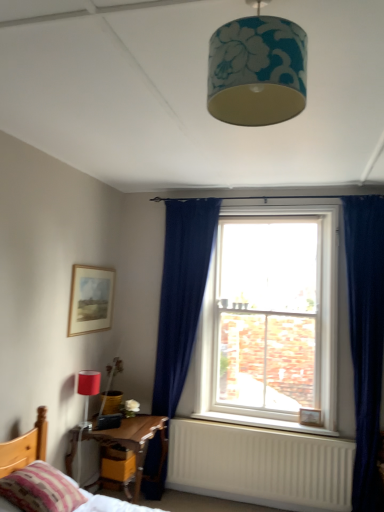
Question: Can you confirm if wooden picture frame at lower right, the first picture frame from the back, is positioned to the right of white painted wood at lower center?

Choices:
 (A) yes
 (B) no

Answer: (A)

Question: Can you confirm if wooden picture frame at lower right, which ranks as the second picture frame in left-to-right order, is smaller than white painted wood at lower center?

Choices:
 (A) yes
 (B) no

Answer: (A)

Question: From the image's perspective, does wooden picture frame at lower right, which ranks as the second picture frame in left-to-right order, appear higher than white painted wood at lower center?

Choices:
 (A) yes
 (B) no

Answer: (A)

Question: Is wooden picture frame at lower right, the first picture frame from the back, aimed at white painted wood at lower center?

Choices:
 (A) yes
 (B) no

Answer: (B)

Question: Is wooden picture frame at lower right, which is counted as the first picture frame, starting from the bottom, closer to camera compared to white painted wood at lower center?

Choices:
 (A) yes
 (B) no

Answer: (B)

Question: Considering the positions of wooden bed at lower left and striped fabric pillow at lower left in the image, is wooden bed at lower left wider or thinner than striped fabric pillow at lower left?

Choices:
 (A) thin
 (B) wide

Answer: (B)

Question: Is wooden bed at lower left taller or shorter than striped fabric pillow at lower left?

Choices:
 (A) short
 (B) tall

Answer: (B)

Question: From a real-world perspective, is wooden bed at lower left above or below striped fabric pillow at lower left?

Choices:
 (A) above
 (B) below

Answer: (B)

Question: Is point (160, 428) positioned closer to the camera than point (31, 483)?

Choices:
 (A) closer
 (B) farther

Answer: (B)

Question: Considering the positions of point (301, 417) and point (107, 461), is point (301, 417) closer or farther from the camera than point (107, 461)?

Choices:
 (A) closer
 (B) farther

Answer: (B)

Question: From a real-world perspective, is wooden picture frame at lower right, the first picture frame from the back, positioned above or below yellow wood drawer at lower left?

Choices:
 (A) above
 (B) below

Answer: (A)

Question: Relative to yellow wood drawer at lower left, is wooden picture frame at lower right, the first picture frame from the back, in front or behind?

Choices:
 (A) front
 (B) behind

Answer: (B)

Question: From the image's perspective, is wooden picture frame at lower right, the first picture frame from the back, located above or below yellow wood drawer at lower left?

Choices:
 (A) below
 (B) above

Answer: (B)

Question: Relative to teal floral fabric lampshade at upper center, acting as the 2th lamp starting from the back, is wooden bed at lower left in front or behind?

Choices:
 (A) behind
 (B) front

Answer: (A)

Question: Is wooden bed at lower left wider or thinner than teal floral fabric lampshade at upper center, the 1th lamp positioned from the front?

Choices:
 (A) wide
 (B) thin

Answer: (A)